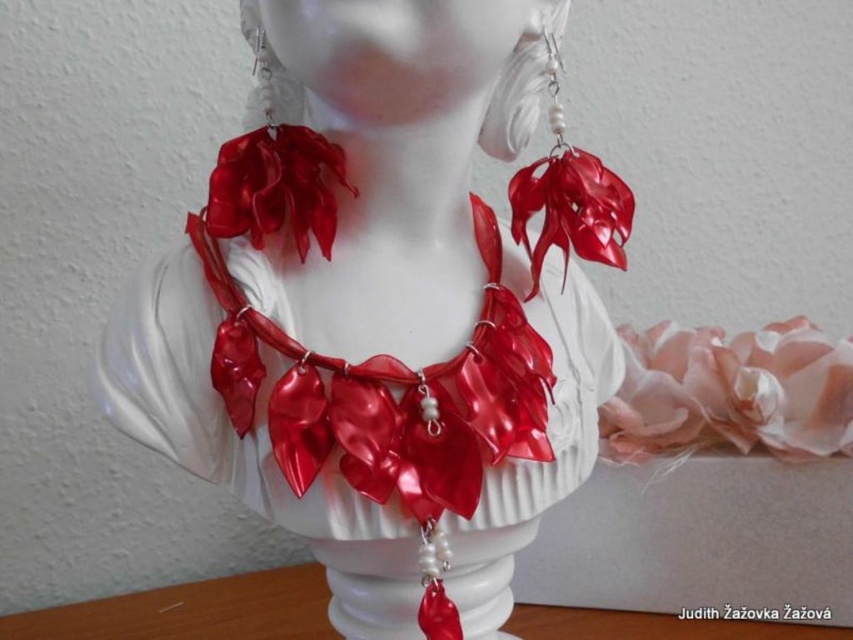
Is glossy plastic flower at upper right bigger than glossy plastic necklace at center?

No, glossy plastic flower at upper right is not bigger than glossy plastic necklace at center.

Between point (619, 221) and point (498, 112), which one is positioned behind?

Positioned behind is point (498, 112).

What do you see at coordinates (570, 209) in the screenshot? The width and height of the screenshot is (853, 640). I see `glossy plastic flower at upper right` at bounding box center [570, 209].

Locate an element on the screen. This screenshot has height=640, width=853. glossy plastic flower at upper right is located at coordinates pyautogui.click(x=570, y=209).

Is shiny red leaves at center above shiny red ribbon at center?

Actually, shiny red leaves at center is below shiny red ribbon at center.

Which is below, shiny red leaves at center or shiny red ribbon at center?

Positioned lower is shiny red leaves at center.

You are a GUI agent. You are given a task and a screenshot of the screen. Output one action in this format:
    pyautogui.click(x=<x>, y=<y>)
    Task: Click on the shiny red leaves at center
    This screenshot has width=853, height=640.
    Given the screenshot: What is the action you would take?
    pyautogui.click(x=389, y=394)

Can you confirm if pink satin flower at center is bigger than shiny red ribbon at center?

Yes, pink satin flower at center is bigger than shiny red ribbon at center.

Which is behind, point (738, 336) or point (314, 212)?

The point (738, 336) is behind.

Where is `pink satin flower at center`? pink satin flower at center is located at coordinates (730, 392).